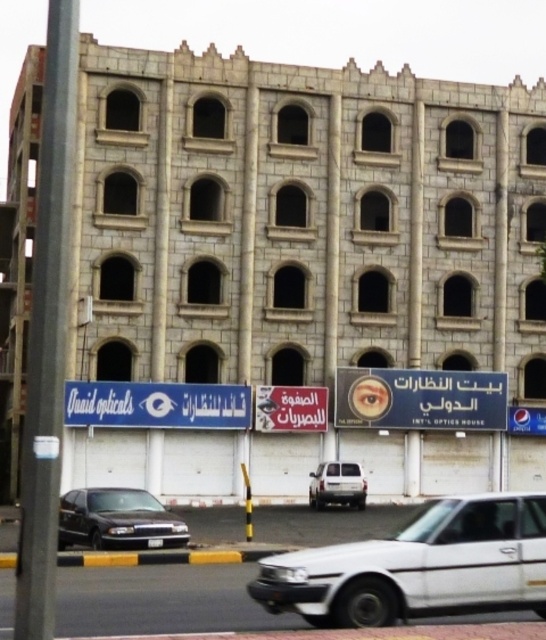
Who is more forward, (x=503, y=496) or (x=485, y=426)?

Point (x=503, y=496)

Can you confirm if white matte car at lower right is smaller than blue plastic signboard at center?

Incorrect, white matte car at lower right is not smaller in size than blue plastic signboard at center.

Is point (507, 589) positioned behind point (459, 413)?

No, it is in front of (459, 413).

Locate an element on the screen. white matte car at lower right is located at coordinates (418, 566).

Can you confirm if shiny black sedan at lower left is smaller than white matte van at center?

Incorrect, shiny black sedan at lower left is not smaller in size than white matte van at center.

The image size is (546, 640). What do you see at coordinates (117, 520) in the screenshot? I see `shiny black sedan at lower left` at bounding box center [117, 520].

The height and width of the screenshot is (640, 546). I want to click on shiny black sedan at lower left, so click(117, 520).

Who is more distant from viewer, (483, 556) or (105, 525)?

The point (105, 525) is more distant.

You are a GUI agent. You are given a task and a screenshot of the screen. Output one action in this format:
    pyautogui.click(x=<x>, y=<y>)
    Task: Click on the white matte car at lower right
    
    Given the screenshot: What is the action you would take?
    pyautogui.click(x=418, y=566)

I want to click on white matte car at lower right, so pyautogui.click(x=418, y=566).